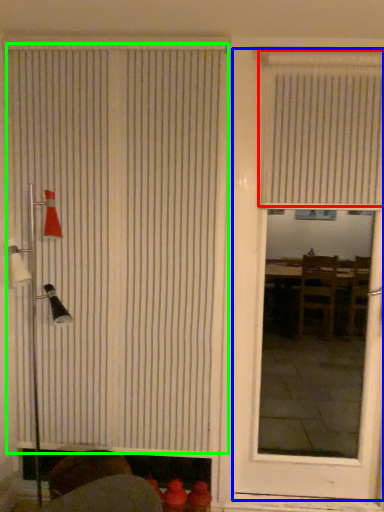
Question: Estimate the real-world distances between objects in this image. Which object is closer to window blind (highlighted by a red box), door (highlighted by a blue box) or window blind (highlighted by a green box)?

Choices:
 (A) door
 (B) window blind

Answer: (A)